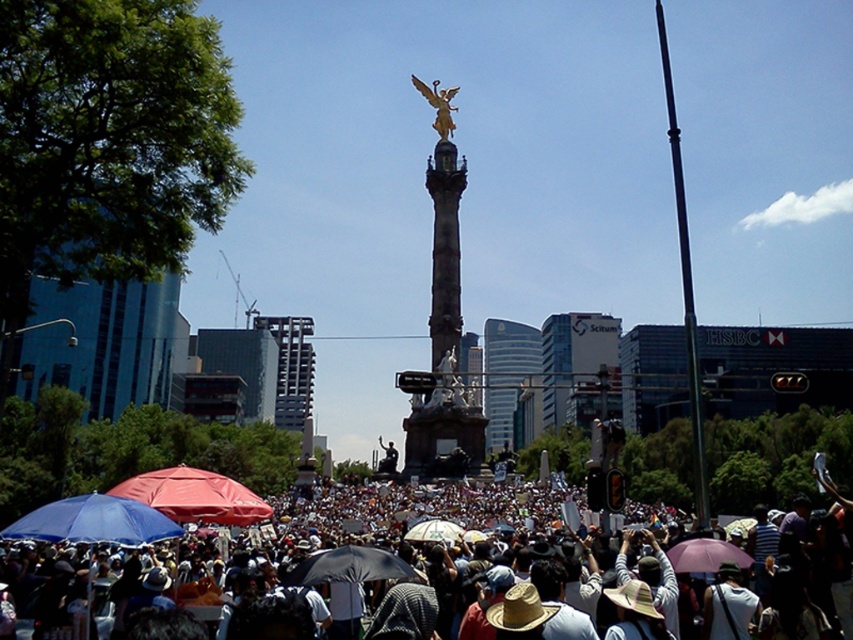
You are standing at the monument and want to take a photo of the glassy blue skyscraper at center. The monument has a restricted area marked by a yellow line. The point where you can legally stand to take the photo is at coordinates point [506,374]. Is this point on the glassy blue skyscraper at center?

Yes, the point [506,374] is on the glassy blue skyscraper at center, so you can legally stand there to take the photo.

You are standing at the center of the monument and want to locate the matte blue umbrella at lower left. According to the coordinates provided, in which direction should you look to find it?

The matte blue umbrella at lower left is located at coordinates point (94, 522), which means it is positioned to the lower left relative to the monument. You should look towards the lower left direction from the monument to find it.

You are standing at the monument and want to take a photo of the glassy blue skyscraper at center. Which direction should you face to ensure the skyscraper is in the frame?

The glassy blue skyscraper at center is located at point coordinates, so you should face towards the center of the monument to capture it in your photo.